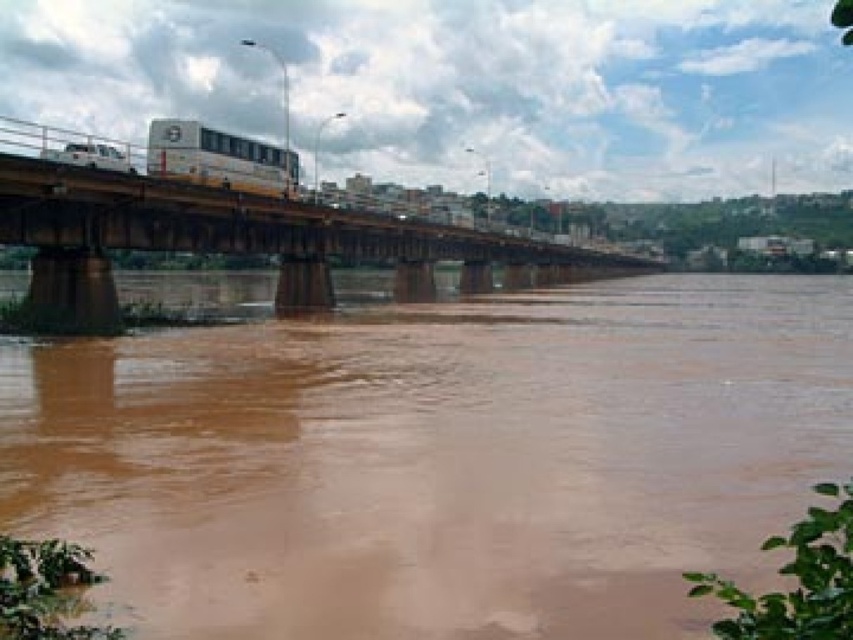
Between brown metallic bridge at center and yellow metallic bus at center, which one appears on the right side from the viewer's perspective?

Positioned to the right is brown metallic bridge at center.

Between brown metallic bridge at center and yellow metallic bus at center, which one appears on the left side from the viewer's perspective?

From the viewer's perspective, yellow metallic bus at center appears more on the left side.

Is point (381, 237) positioned after point (207, 163)?

Yes, point (381, 237) is farther from viewer.

Identify the location of brown metallic bridge at center. The height and width of the screenshot is (640, 853). (242, 241).

Does brown muddy water at center come behind brown metallic bridge at center?

That is False.

Does point (325, 616) lie behind point (184, 180)?

No.

Does point (653, 296) come in front of point (271, 211)?

No, (653, 296) is further to viewer.

The width and height of the screenshot is (853, 640). I want to click on brown muddy water at center, so click(x=439, y=458).

Between brown muddy water at center and yellow metallic bus at center, which one is positioned lower?

brown muddy water at center is below.

Can you confirm if brown muddy water at center is taller than yellow metallic bus at center?

Correct, brown muddy water at center is much taller as yellow metallic bus at center.

Is point (337, 456) positioned before point (270, 147)?

Yes, point (337, 456) is closer to viewer.

At what (x,y) coordinates should I click in order to perform the action: click on brown muddy water at center. Please return your answer as a coordinate pair (x, y). Looking at the image, I should click on (439, 458).